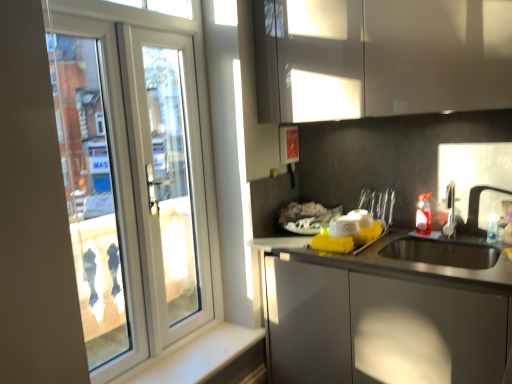
In order to click on blank space above white smooth window sill at lower left (from a real-world perspective) in this screenshot , I will do `click(185, 364)`.